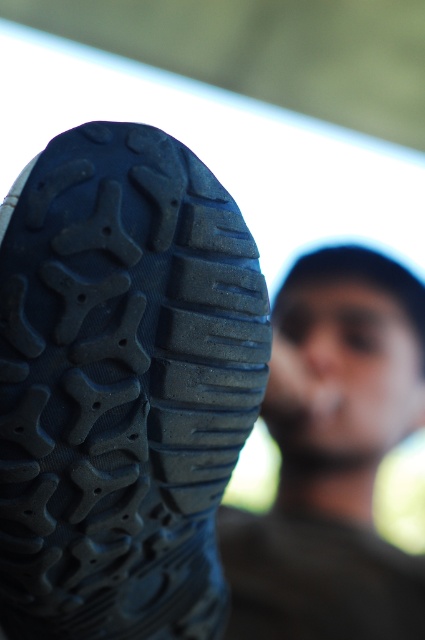
You are a delivery person who needs to place a package between the black rubber shoe at lower left and the dark brown leather shoe at lower left. Can you fit the package, which is 26 inches long, between them?

The black rubber shoe at lower left and dark brown leather shoe at lower left are 25.98 inches apart, so the package which is 26 inches long cannot fit between them as the space is slightly smaller than the package.

In the scene shown: You are a shoe designer analyzing the image. You need to determine which shoe is shorter between the black rubber shoe at lower left and the dark brown leather shoe at lower left. Based on the scene, which one is shorter?

The black rubber shoe at lower left is shorter than the dark brown leather shoe at lower left.